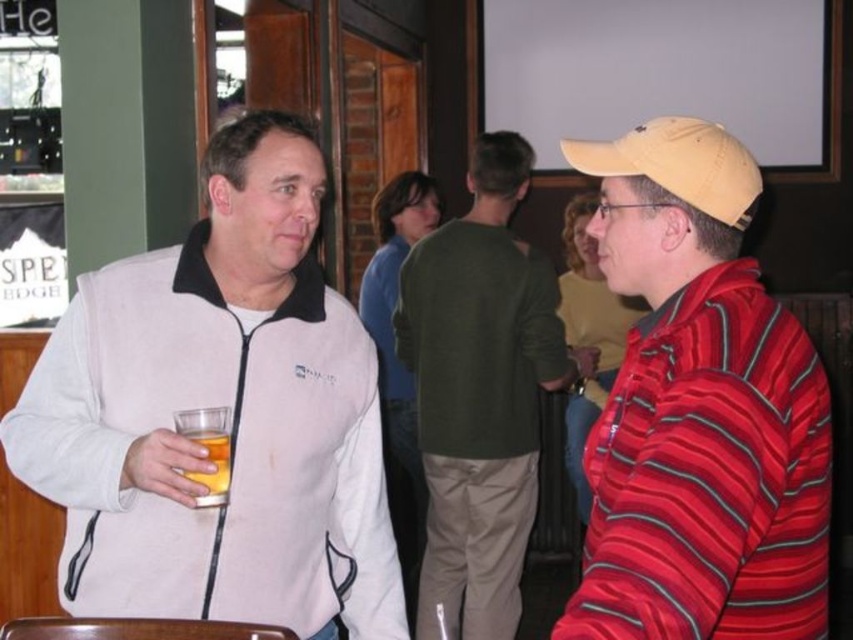
You are a delivery robot with a width of 1.5 meters. You need to pass between the striped cotton shirt at right and the green cotton sweater at center. Can you fit through the space between them?

The distance between the striped cotton shirt at right and the green cotton sweater at center is 1.79 meters. Since the robot is 1.5 meters wide, it can fit through the space as there is enough width available.

In the scene shown: You are standing in the scene and want to place a small decorative item at the point marked as point (62, 424). If your arm reaches 1.5 meters, can you comfortably place the item without moving closer?

The distance of point (62, 424) from viewer is 1.66 meters, so your arm can only reach 1.5 meters. You need to move closer to place the item.

You are organizing a clothing donation drive and need to categorize items based on their sizes. You have two items to sort out. The first is a striped cotton shirt at right, and the second is a green cotton sweater at center. Which of these two items is smaller in size?

The striped cotton shirt at right is smaller in size compared to the green cotton sweater at center.